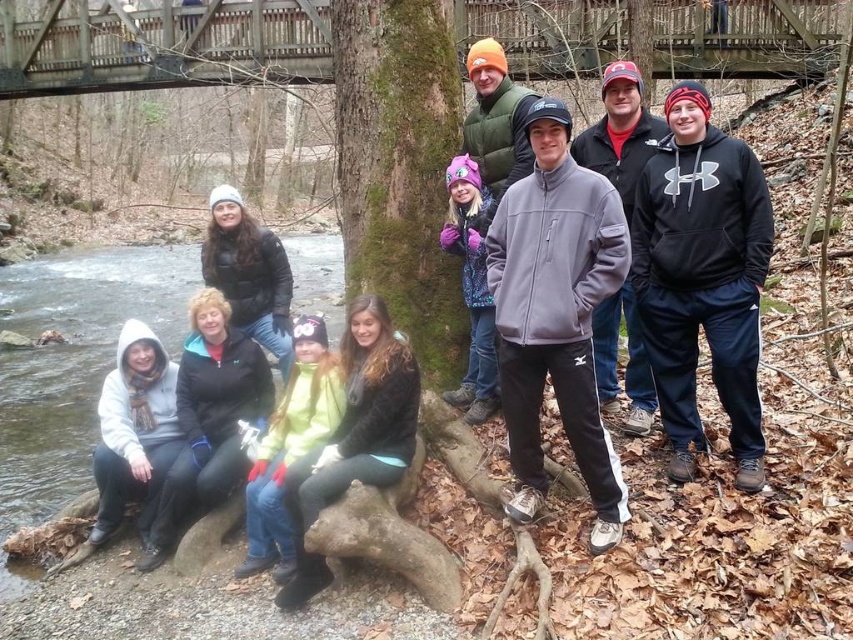
You are standing in the forest scene and want to place a small flag exactly halfway between point (228, 252) and point (474, 301). Will the flag be closer to the camera or further away from the camera compared to the average depth of these two points?

The flag placed halfway between point (228, 252) and point (474, 301) will be closer to the camera than the average depth because point (228, 252) is closer to the camera than point (474, 301).

You are a photographer trying to capture a closeup of the gray fleece jacket at center. What are the coordinates where you should focus your camera?

The gray fleece jacket at center is located at coordinates point (x=556, y=314).